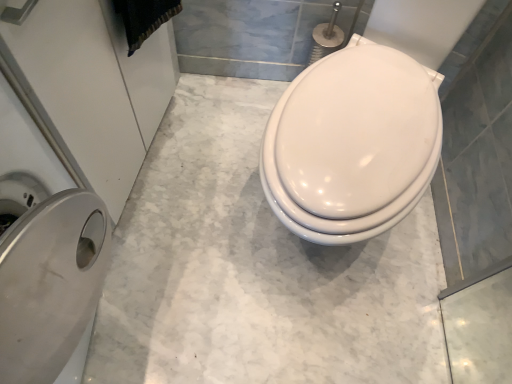
Consider the image. In order to face white glossy toilet at center, should I rotate leftwards or rightwards?

You should rotate right by 16.569 degrees.

At what (x,y) coordinates should I click in order to perform the action: click on black fabric at upper left. Please return your answer as a coordinate pair (x, y). The image size is (512, 384). Looking at the image, I should click on click(144, 18).

From the image's perspective, is silver metallic trash can at left on white glossy toilet at center?

No.

Would you say white glossy toilet at center is part of silver metallic trash can at left's contents?

No, silver metallic trash can at left does not contain white glossy toilet at center.

From the picture: Is silver metallic trash can at left taller than white glossy toilet at center?

Incorrect, the height of silver metallic trash can at left is not larger of that of white glossy toilet at center.

From a real-world perspective, is silver metallic trash can at left physically located above or below white glossy toilet at center?

In terms of real-world spatial position, silver metallic trash can at left is below white glossy toilet at center.

Identify the location of material lying behind the silver metallic trash can at left. The height and width of the screenshot is (384, 512). (144, 18).

How many degrees apart are the facing directions of black fabric at upper left and silver metallic trash can at left?

They differ by 24.6 degrees in their facing directions.

Can you confirm if black fabric at upper left is shorter than silver metallic trash can at left?

Indeed, black fabric at upper left has a lesser height compared to silver metallic trash can at left.

Is black fabric at upper left thinner than silver metallic trash can at left?

Correct, the width of black fabric at upper left is less than that of silver metallic trash can at left.

From a real-world perspective, does white glossy toilet at center sit lower than silver metallic trash can at left?

No, from a real-world perspective, white glossy toilet at center is not below silver metallic trash can at left.

Is white glossy toilet at center behind silver metallic trash can at left?

Yes, white glossy toilet at center is behind silver metallic trash can at left.

Can you confirm if white glossy toilet at center is bigger than silver metallic trash can at left?

Yes.

Is silver metallic trash can at left completely or partially inside white glossy toilet at center?

No, silver metallic trash can at left is not surrounded by white glossy toilet at center.

Is silver metallic trash can at left bigger or smaller than black fabric at upper left?

Considering their sizes, silver metallic trash can at left takes up more space than black fabric at upper left.

Where is `screen door in front of the black fabric at upper left`? The image size is (512, 384). screen door in front of the black fabric at upper left is located at coordinates (81, 91).

From the image's perspective, is silver metallic trash can at left above black fabric at upper left?

Incorrect, from the image's perspective, silver metallic trash can at left is lower than black fabric at upper left.

Is black fabric at upper left situated inside white glossy toilet at center or outside?

black fabric at upper left exists outside the volume of white glossy toilet at center.

Is black fabric at upper left to the left of white glossy toilet at center from the viewer's perspective?

Correct, you'll find black fabric at upper left to the left of white glossy toilet at center.

Is the position of black fabric at upper left more distant than that of white glossy toilet at center?

Yes.

Is point (158, 6) closer or farther from the camera than point (393, 115)?

Point (158, 6) appears to be farther away from the viewer than point (393, 115).

Identify the location of material that appears above the white glossy toilet at center (from the image's perspective). Image resolution: width=512 pixels, height=384 pixels. 144,18.

How different are the orientations of white glossy toilet at center and black fabric at upper left in degrees?

89.7 degrees.

Considering the positions of objects white glossy toilet at center and black fabric at upper left in the image provided, who is more to the left, white glossy toilet at center or black fabric at upper left?

black fabric at upper left.

Which object is further away from the camera, white glossy toilet at center or black fabric at upper left?

black fabric at upper left is more distant.

Locate an element on the screen. This screenshot has height=384, width=512. toilet above the silver metallic trash can at left (from the image's perspective) is located at coordinates (352, 144).

The width and height of the screenshot is (512, 384). I want to click on material that is above the silver metallic trash can at left (from a real-world perspective), so click(144, 18).

Looking at the image, which one is located closer to black fabric at upper left, white glossy toilet at center or silver metallic trash can at left?

The object closer to black fabric at upper left is silver metallic trash can at left.

Consider the image. When comparing their distances from silver metallic trash can at left, does white glossy toilet at center or black fabric at upper left seem further?

white glossy toilet at center.

Considering their positions, is silver metallic trash can at left positioned further to white glossy toilet at center than black fabric at upper left?

silver metallic trash can at left is positioned further to the anchor white glossy toilet at center.

Based on their spatial positions, is black fabric at upper left or white glossy toilet at center further from silver metallic trash can at left?

white glossy toilet at center.

Looking at the image, which one is located further to white glossy toilet at center, black fabric at upper left or silver metallic trash can at left?

silver metallic trash can at left is positioned further to the anchor white glossy toilet at center.

Which object lies further to the anchor point black fabric at upper left, silver metallic trash can at left or white glossy toilet at center?

white glossy toilet at center is further to black fabric at upper left.

Identify the location of material between silver metallic trash can at left and white glossy toilet at center from left to right. (144, 18).